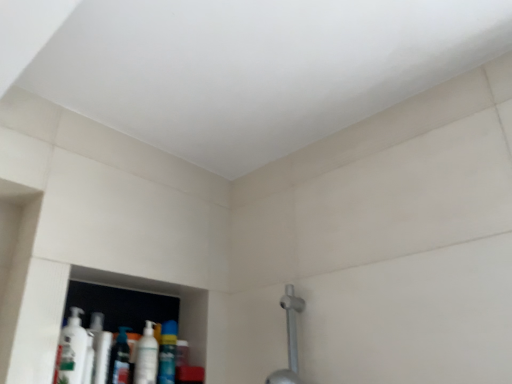
Question: Is translucent plastic mouthwash at lower left, the third mouthwash viewed from the right, not inside silver metallic shower at lower right?

Choices:
 (A) yes
 (B) no

Answer: (A)

Question: Is silver metallic shower at lower right inside translucent plastic mouthwash at lower left, the third mouthwash viewed from the right?

Choices:
 (A) yes
 (B) no

Answer: (B)

Question: Does translucent plastic mouthwash at lower left, which is the second mouthwash in left-to-right order, have a lesser width compared to silver metallic shower at lower right?

Choices:
 (A) yes
 (B) no

Answer: (A)

Question: From the image's perspective, is translucent plastic mouthwash at lower left, the third mouthwash viewed from the right, on top of silver metallic shower at lower right?

Choices:
 (A) no
 (B) yes

Answer: (A)

Question: Is translucent plastic mouthwash at lower left, which is the second mouthwash in left-to-right order, bigger than silver metallic shower at lower right?

Choices:
 (A) no
 (B) yes

Answer: (A)

Question: Is translucent plastic mouthwash at lower left, which is the second mouthwash in left-to-right order, with silver metallic shower at lower right?

Choices:
 (A) no
 (B) yes

Answer: (A)

Question: Is white glossy mouthwash at lower left, which is the 2th mouthwash in right-to-left order, positioned before translucent plastic mouthwash at lower left, which is the second mouthwash in left-to-right order?

Choices:
 (A) yes
 (B) no

Answer: (A)

Question: From a real-world perspective, does white glossy mouthwash at lower left, acting as the third mouthwash starting from the left, stand above translucent plastic mouthwash at lower left, which is the second mouthwash in left-to-right order?

Choices:
 (A) yes
 (B) no

Answer: (A)

Question: Considering the relative sizes of white glossy mouthwash at lower left, which is the 2th mouthwash in right-to-left order, and translucent plastic mouthwash at lower left, the third mouthwash viewed from the right, in the image provided, is white glossy mouthwash at lower left, which is the 2th mouthwash in right-to-left order, wider than translucent plastic mouthwash at lower left, the third mouthwash viewed from the right,?

Choices:
 (A) no
 (B) yes

Answer: (B)

Question: Does white glossy mouthwash at lower left, acting as the third mouthwash starting from the left, lie behind translucent plastic mouthwash at lower left, which is the second mouthwash in left-to-right order?

Choices:
 (A) yes
 (B) no

Answer: (B)

Question: Is white glossy mouthwash at lower left, which is the 2th mouthwash in right-to-left order, smaller than translucent plastic mouthwash at lower left, the third mouthwash viewed from the right?

Choices:
 (A) yes
 (B) no

Answer: (B)

Question: Is white glossy mouthwash at lower left, which is the 2th mouthwash in right-to-left order, not inside translucent plastic mouthwash at lower left, the third mouthwash viewed from the right?

Choices:
 (A) yes
 (B) no

Answer: (A)

Question: Does white glossy mouthwash at lower left, acting as the 4th mouthwash starting from the right, touch white glossy mouthwash at lower left, acting as the third mouthwash starting from the left?

Choices:
 (A) no
 (B) yes

Answer: (A)